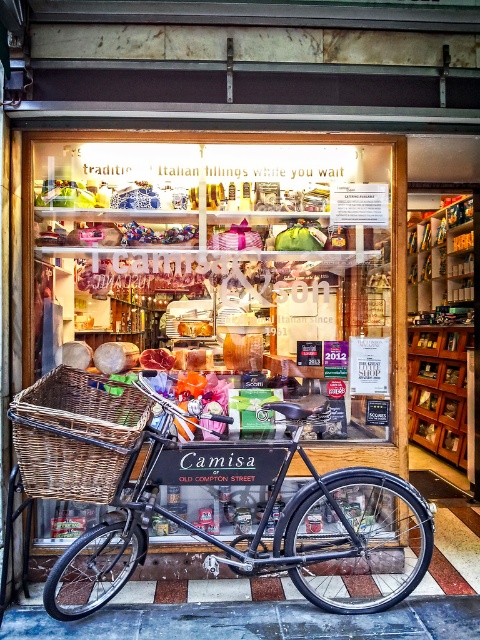
You are standing in front of the Camisa shop on Old Compton Street and need to place a new display stand for a promotional event. The stand requires a space that is not occupied by the matte black bicycle at center. Based on the coordinates provided, where should you position the stand to avoid overlapping with the bicycle?

The matte black bicycle at center is located at coordinates point (x=259, y=522). To avoid overlapping, position the display stand in an area outside these coordinates, such as to the left or right of the bicycle.

You are standing in front of the Camisa shop on Old Compton Street. You notice two points marked on the display window. The first point is at coordinates point (328,317) and the second is at point (19,454). If you were to touch both points through the glass, which point would feel closer to your hand?

Point (19,454) is closer to your hand because it is nearer to the camera than point (328,317), which is further away.

From the picture: You are a customer trying to reach the items in the display window of Camisa shop. You notice both the wooden crate at center and the woven brown basket at center. Which one do you think you can easily lift and carry since it might be lighter?

The woven brown basket at center is smaller in size than the wooden crate at center, so it is likely lighter and easier to lift and carry.